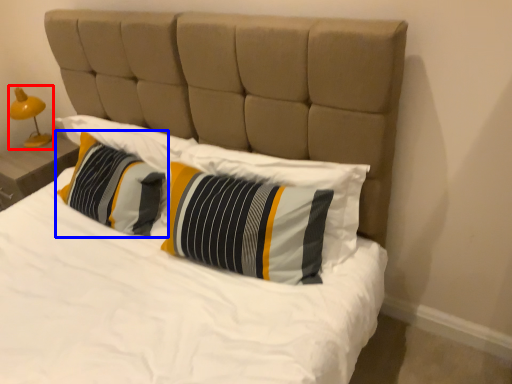
Question: Among these objects, which one is nearest to the camera, bedside lamp (highlighted by a red box) or pillow (highlighted by a blue box)?

Choices:
 (A) bedside lamp
 (B) pillow

Answer: (B)